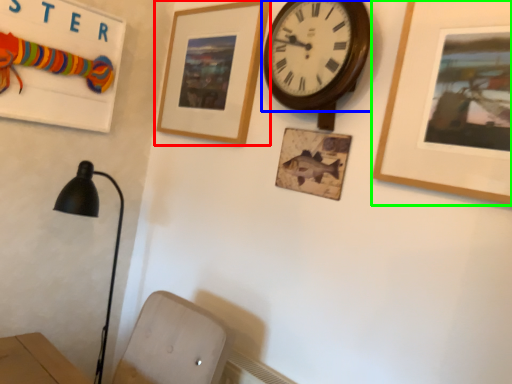
Question: Which object is positioned farthest from picture frame (highlighted by a red box)? Select from wall clock (highlighted by a blue box) and picture frame (highlighted by a green box).

Choices:
 (A) wall clock
 (B) picture frame

Answer: (B)